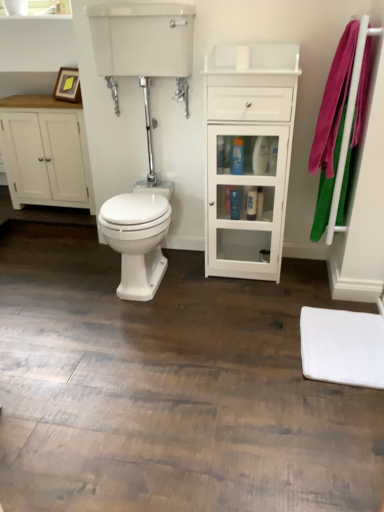
The height and width of the screenshot is (512, 384). Find the location of `free space to the right of white glossy bidet at center`. free space to the right of white glossy bidet at center is located at coordinates (213, 290).